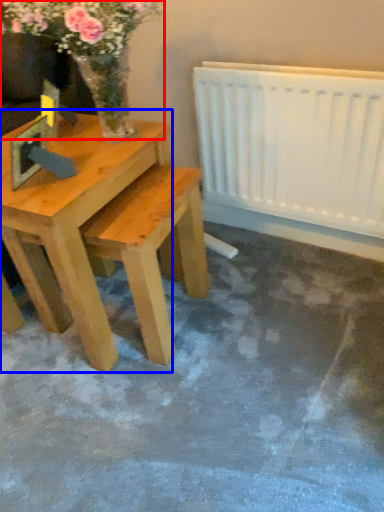
Question: Which object appears farthest to the camera in this image, floral arrangement (highlighted by a red box) or table (highlighted by a blue box)?

Choices:
 (A) floral arrangement
 (B) table

Answer: (B)